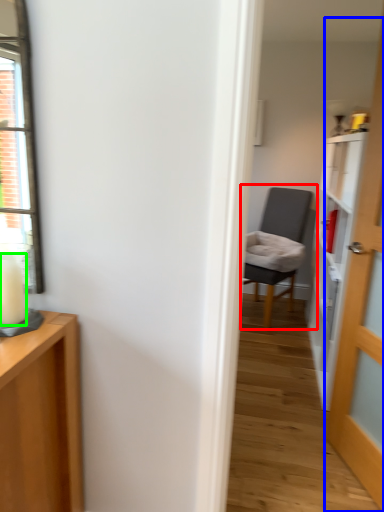
Question: Which is nearer to the chair (highlighted by a red box)? door (highlighted by a blue box) or candle (highlighted by a green box).

Choices:
 (A) door
 (B) candle

Answer: (A)